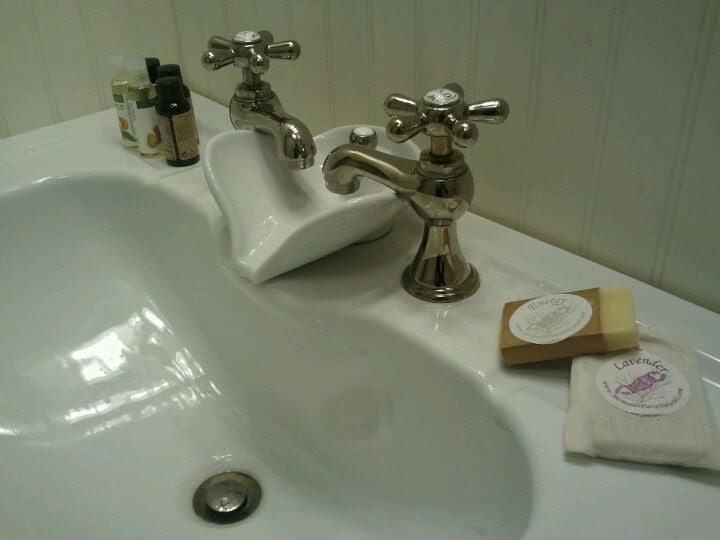
Where is `right handle`? This screenshot has height=540, width=720. right handle is located at coordinates (450, 112).